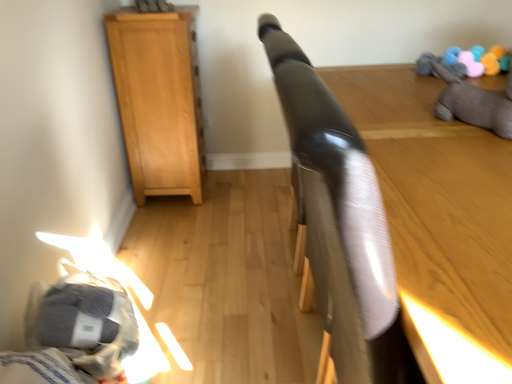
Question: Is gray plush toy at upper right outside of glossy black headboard at upper center, the second furniture viewed from the back?

Choices:
 (A) no
 (B) yes

Answer: (B)

Question: Can you confirm if gray plush toy at upper right is bigger than glossy black headboard at upper center, the 1th furniture when ordered from right to left?

Choices:
 (A) no
 (B) yes

Answer: (A)

Question: Does gray plush toy at upper right have a greater height compared to glossy black headboard at upper center, which ranks as the 2th furniture in left-to-right order?

Choices:
 (A) yes
 (B) no

Answer: (B)

Question: Does gray plush toy at upper right lie behind glossy black headboard at upper center, which ranks as the 2th furniture in left-to-right order?

Choices:
 (A) yes
 (B) no

Answer: (A)

Question: Is gray plush toy at upper right smaller than glossy black headboard at upper center, the 1th furniture when ordered from right to left?

Choices:
 (A) no
 (B) yes

Answer: (B)

Question: Is glossy black headboard at upper center, which ranks as the 2th furniture in left-to-right order, surrounded by gray plush toy at upper right?

Choices:
 (A) no
 (B) yes

Answer: (A)

Question: Can you confirm if gray fabric bed at lower left is wider than soft woolen balls at upper right?

Choices:
 (A) yes
 (B) no

Answer: (B)

Question: Can you see gray fabric bed at lower left touching soft woolen balls at upper right?

Choices:
 (A) no
 (B) yes

Answer: (A)

Question: Is gray fabric bed at lower left oriented towards soft woolen balls at upper right?

Choices:
 (A) no
 (B) yes

Answer: (A)

Question: Considering the relative positions of gray fabric bed at lower left and soft woolen balls at upper right in the image provided, is gray fabric bed at lower left to the left of soft woolen balls at upper right from the viewer's perspective?

Choices:
 (A) no
 (B) yes

Answer: (B)

Question: Is gray fabric bed at lower left facing away from soft woolen balls at upper right?

Choices:
 (A) yes
 (B) no

Answer: (B)

Question: Are gray fabric bed at lower left and soft woolen balls at upper right located far from each other?

Choices:
 (A) yes
 (B) no

Answer: (A)

Question: Considering the relative positions of gray plush toy at upper right and light brown wood cabinet at left, the 1th furniture from the left, in the image provided, is gray plush toy at upper right to the left of light brown wood cabinet at left, the 1th furniture from the left, from the viewer's perspective?

Choices:
 (A) no
 (B) yes

Answer: (A)